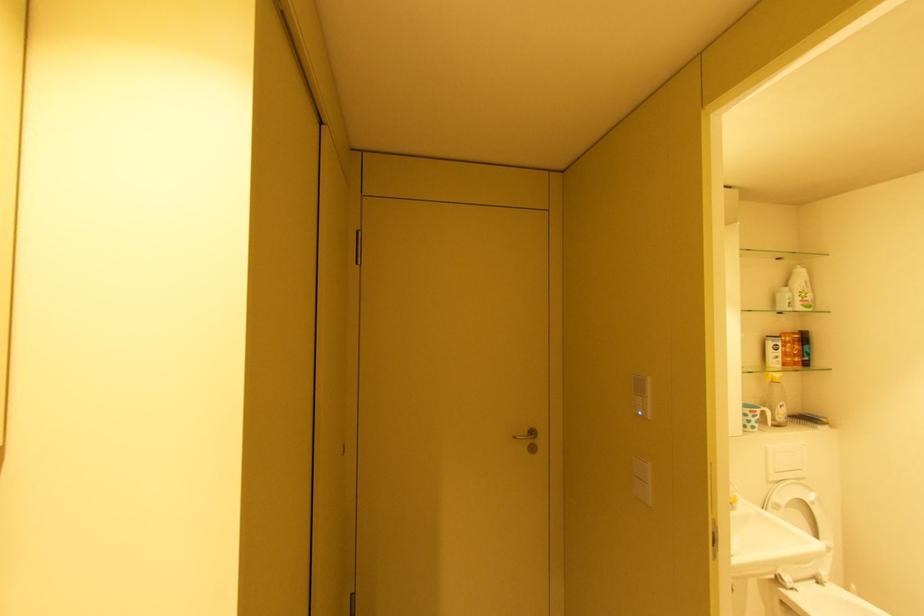
The image size is (924, 616). What do you see at coordinates (772, 377) in the screenshot?
I see `the spray bottle trigger` at bounding box center [772, 377].